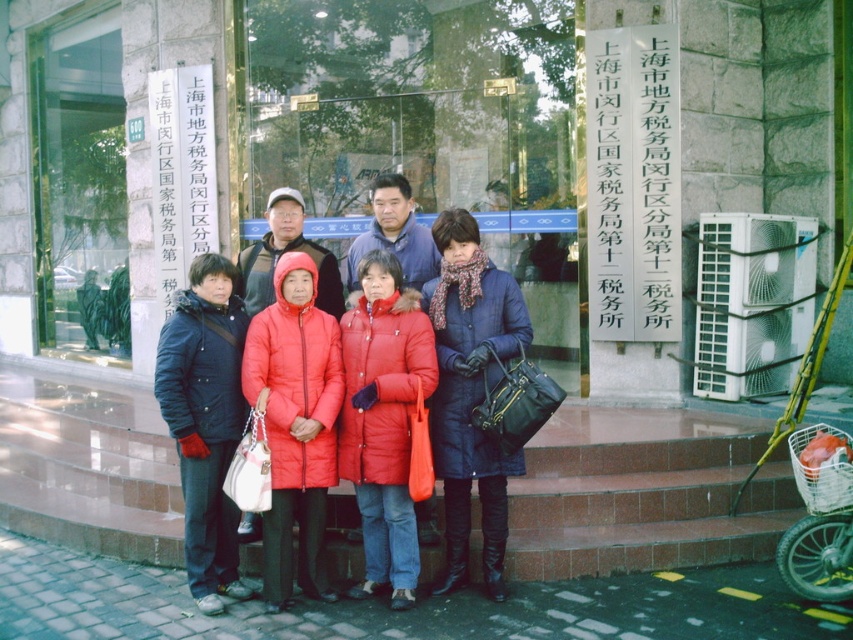
Looking at this image, is red down coat at center shorter than denim coat at center?

Yes.

Who is more distant from viewer, (428, 380) or (477, 298)?

Point (477, 298)

You are a GUI agent. You are given a task and a screenshot of the screen. Output one action in this format:
    pyautogui.click(x=<x>, y=<y>)
    Task: Click on the red down coat at center
    
    Given the screenshot: What is the action you would take?
    pyautogui.click(x=381, y=385)

Describe the element at coordinates (285, 250) in the screenshot. This screenshot has width=853, height=640. I see `red down jackets at center` at that location.

Between point (252, 257) and point (341, 476), which one is positioned behind?

The point (252, 257) is more distant.

Where is `red down jackets at center`? Image resolution: width=853 pixels, height=640 pixels. red down jackets at center is located at coordinates (285, 250).

Is red down jackets at center positioned in front of matte red puffer coat at center?

No, it is not.

Can you confirm if red down jackets at center is positioned to the left of matte red puffer coat at center?

Indeed, red down jackets at center is positioned on the left side of matte red puffer coat at center.

Where is `red down jackets at center`? The image size is (853, 640). red down jackets at center is located at coordinates (285, 250).